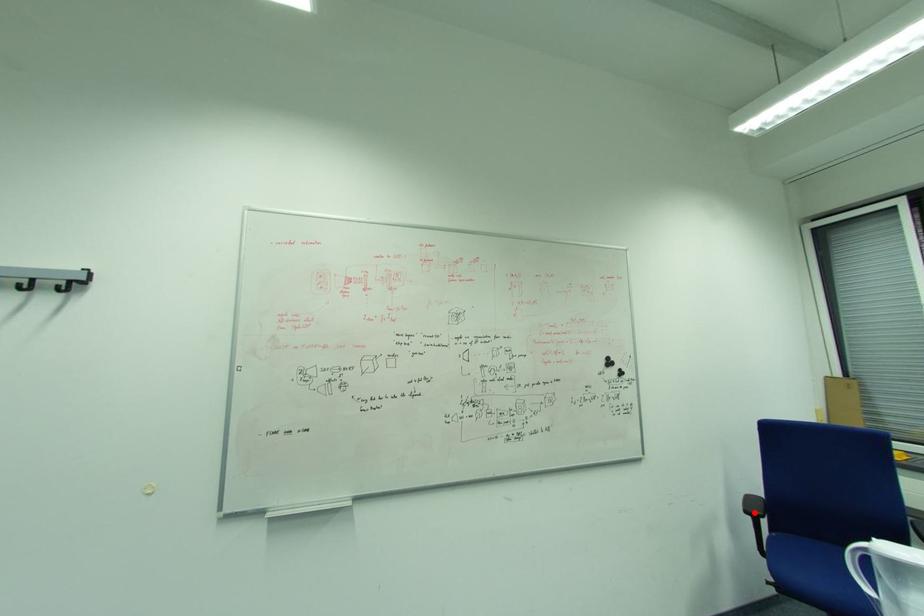
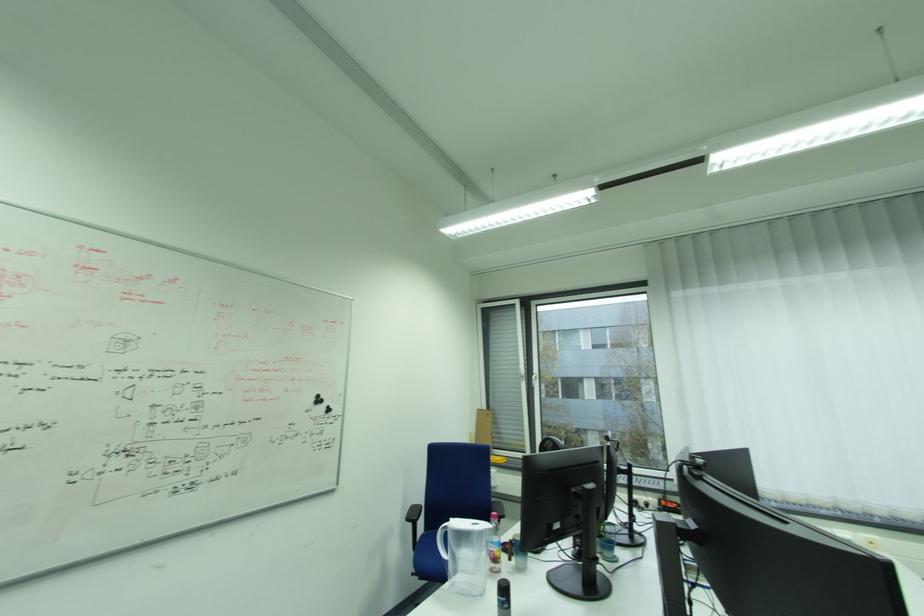
Question: I am providing you with two images of the same scene from different viewpoints. A red point is shown in image1. For the corresponding object point in image2, is it positioned nearer or farther from the camera?

Choices:
 (A) Nearer
 (B) Farther

Answer: (B)